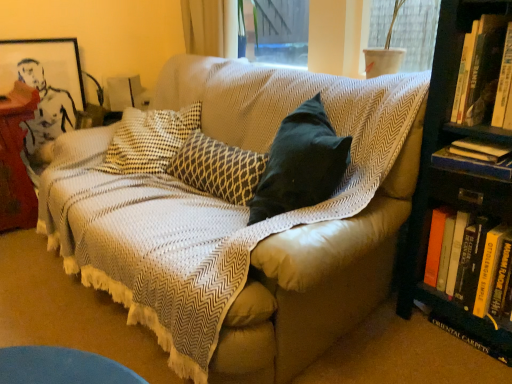
Question: Is hardcover book at right, which ranks as the fourth book in bottom-to-top order, touching hardcover book at right, which ranks as the second book in bottom-to-top order?

Choices:
 (A) no
 (B) yes

Answer: (A)

Question: Is the depth of hardcover book at right, which ranks as the fourth book in bottom-to-top order, less than that of hardcover book at right, which ranks as the second book in bottom-to-top order?

Choices:
 (A) no
 (B) yes

Answer: (B)

Question: Does hardcover book at right, placed as the first book when sorted from top to bottom, have a lesser width compared to hardcover book at right, which is the 3th book from top to bottom?

Choices:
 (A) no
 (B) yes

Answer: (A)

Question: Could you tell me if hardcover book at right, which ranks as the fourth book in bottom-to-top order, is facing hardcover book at right, which is the 3th book from top to bottom?

Choices:
 (A) no
 (B) yes

Answer: (A)

Question: Is there a large distance between hardcover book at right, which ranks as the fourth book in bottom-to-top order, and hardcover book at right, which is the 3th book from top to bottom?

Choices:
 (A) no
 (B) yes

Answer: (A)

Question: Considering the relative positions of textured beige couch at center and hardcover book at right, arranged as the first book when ordered from the bottom, in the image provided, is textured beige couch at center to the left or to the right of hardcover book at right, arranged as the first book when ordered from the bottom,?

Choices:
 (A) left
 (B) right

Answer: (A)

Question: In terms of width, does textured beige couch at center look wider or thinner when compared to hardcover book at right, arranged as the first book when ordered from the bottom?

Choices:
 (A) wide
 (B) thin

Answer: (A)

Question: Would you say textured beige couch at center is inside or outside hardcover book at right, the fourth book viewed from the top?

Choices:
 (A) inside
 (B) outside

Answer: (B)

Question: Does point (352, 208) appear closer or farther from the camera than point (476, 296)?

Choices:
 (A) farther
 (B) closer

Answer: (B)

Question: From a real-world perspective, is textured beige couch at center above or below hardcover book at right, the third book ordered from the bottom?

Choices:
 (A) below
 (B) above

Answer: (A)

Question: Is textured beige couch at center to the left or to the right of hardcover book at right, the second book when ordered from top to bottom, in the image?

Choices:
 (A) right
 (B) left

Answer: (B)

Question: In the image, is textured beige couch at center positioned in front of or behind hardcover book at right, the second book when ordered from top to bottom?

Choices:
 (A) front
 (B) behind

Answer: (A)

Question: Considering the positions of textured beige couch at center and hardcover book at right, the third book ordered from the bottom, in the image, is textured beige couch at center wider or thinner than hardcover book at right, the third book ordered from the bottom,?

Choices:
 (A) wide
 (B) thin

Answer: (A)

Question: From the image's perspective, is white plastic pot at upper right located above or below hardcover book at right, the fourth book viewed from the top?

Choices:
 (A) above
 (B) below

Answer: (A)

Question: Does point (428, 36) appear closer or farther from the camera than point (504, 256)?

Choices:
 (A) closer
 (B) farther

Answer: (B)